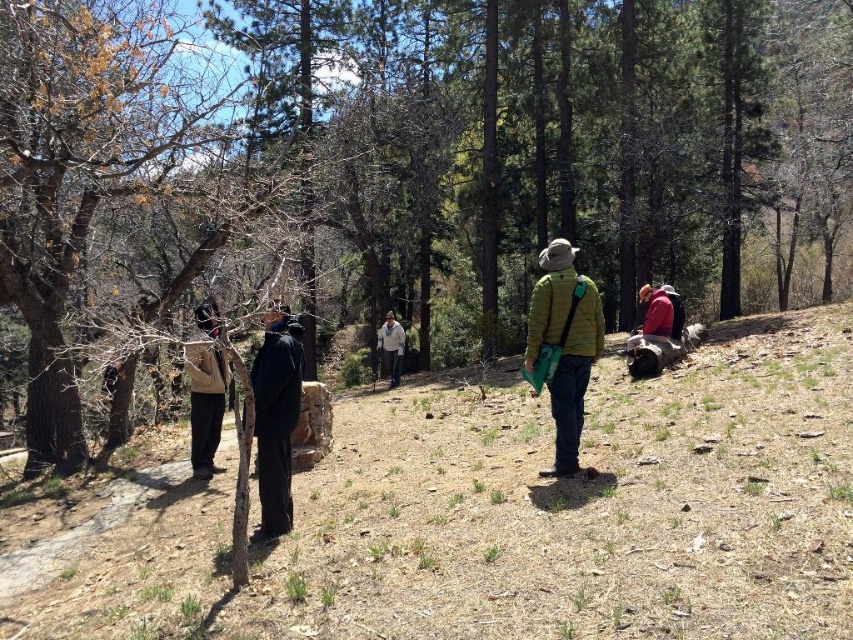
You are standing at the point labeled as point (563, 346) in the forest scene. What object are you currently standing on?

You are standing on the green matte jacket at center, as the point (563, 346) is located on it.

You are planning to take a photo of the two people wearing the green matte jacket at center and the light beige sweater at center. Which person should you focus on to capture more of their clothing details?

You should focus on the light beige sweater at center because it occupies more space in the frame than the green matte jacket at center, allowing for clearer details.

You are planning to place a beige fabric jacket at left on the brown dirt ground at center. Based on their widths, will the jacket fit entirely on the ground without hanging off the edges?

The brown dirt ground at center might be wider than beige fabric jacket at left, so there is a possibility that the jacket will fit, but the exact width comparison is uncertain.